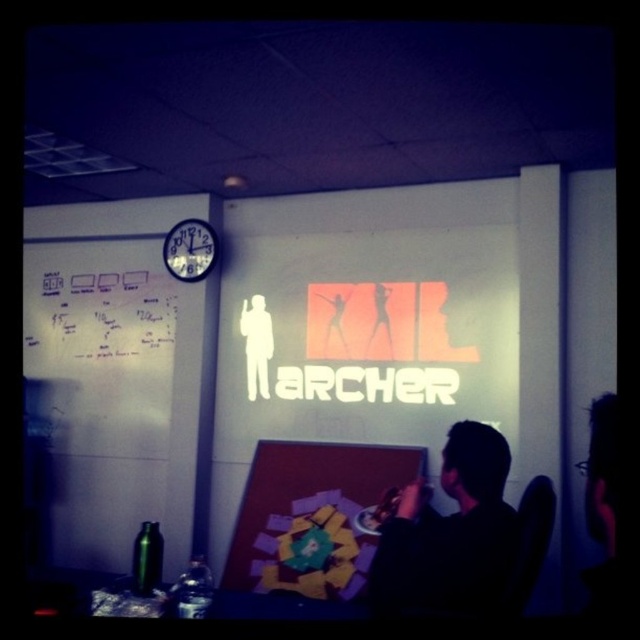
You are standing in the middle of the room and want to pick up the black matte shirt at lower right. Based on its coordinates, in which direction should you move to reach it?

The black matte shirt at lower right is located at coordinates point (449, 532), so you should move to the right and slightly downward from your current position in the middle of the room to reach it.

You are organizing a meeting in this room and need to place a name tag on the table. The name tag is the same size as the white plastic clock at upper left. Will it fit on the black matte shirt at lower right?

The black matte shirt at lower right has a larger size compared to the white plastic clock at upper left. Since the name tag is the same size as the clock, it will fit on the shirt because the shirt is larger.

You are an office assistant who needs to determine which item is bigger between the black matte shirt at lower right and the black leather chair at lower right. Can you identify the larger object?

The black matte shirt at lower right is larger in size than the black leather chair at lower right.